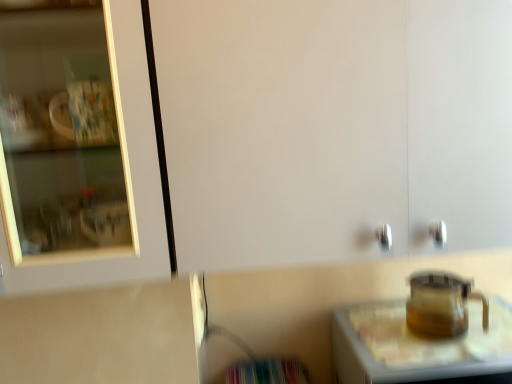
Where is `transparent glass teapot at lower right`? This screenshot has width=512, height=384. transparent glass teapot at lower right is located at coordinates click(441, 304).

This screenshot has height=384, width=512. What do you see at coordinates (441, 304) in the screenshot?
I see `transparent glass teapot at lower right` at bounding box center [441, 304].

The width and height of the screenshot is (512, 384). Describe the element at coordinates (420, 346) in the screenshot. I see `transparent glass table at lower right` at that location.

Identify the location of transparent glass table at lower right. (420, 346).

Where is `transparent glass teapot at lower right`? This screenshot has height=384, width=512. transparent glass teapot at lower right is located at coordinates (441, 304).

Does transparent glass teapot at lower right appear on the left side of transparent glass table at lower right?

Yes, transparent glass teapot at lower right is to the left of transparent glass table at lower right.

In the image, is transparent glass teapot at lower right positioned in front of or behind transparent glass table at lower right?

In the image, transparent glass teapot at lower right appears behind transparent glass table at lower right.

Between point (487, 330) and point (506, 341), which one is positioned behind?

The point (487, 330) is behind.

From the image's perspective, is transparent glass teapot at lower right beneath transparent glass table at lower right?

Actually, transparent glass teapot at lower right appears above transparent glass table at lower right in the image.

From a real-world perspective, is transparent glass teapot at lower right on transparent glass table at lower right?

Yes, from a real-world perspective, transparent glass teapot at lower right is on top of transparent glass table at lower right.

Considering the relative sizes of transparent glass teapot at lower right and transparent glass table at lower right in the image provided, is transparent glass teapot at lower right wider than transparent glass table at lower right?

In fact, transparent glass teapot at lower right might be narrower than transparent glass table at lower right.

Is transparent glass teapot at lower right taller than transparent glass table at lower right?

No.

Can you confirm if transparent glass teapot at lower right is bigger than transparent glass table at lower right?

No, transparent glass teapot at lower right is not bigger than transparent glass table at lower right.

Consider the image. Is transparent glass teapot at lower right positioned beyond the bounds of transparent glass table at lower right?

transparent glass teapot at lower right is positioned outside transparent glass table at lower right.

Consider the image. Does transparent glass teapot at lower right touch transparent glass table at lower right?

Yes, transparent glass teapot at lower right is with transparent glass table at lower right.

Is transparent glass teapot at lower right aimed at transparent glass table at lower right?

No, transparent glass teapot at lower right does not turn towards transparent glass table at lower right.

How different are the orientations of transparent glass teapot at lower right and transparent glass table at lower right in degrees?

There is a 0.00026-degree angle between the facing directions of transparent glass teapot at lower right and transparent glass table at lower right.

How far apart are transparent glass teapot at lower right and transparent glass table at lower right?

The distance of transparent glass teapot at lower right from transparent glass table at lower right is 8.77 centimeters.

Find the location of a particular element. The width and height of the screenshot is (512, 384). table located below the transparent glass teapot at lower right (from the image's perspective) is located at coordinates (420, 346).

Considering the relative positions of transparent glass table at lower right and transparent glass teapot at lower right in the image provided, is transparent glass table at lower right to the left of transparent glass teapot at lower right from the viewer's perspective?

In fact, transparent glass table at lower right is to the right of transparent glass teapot at lower right.

Does transparent glass table at lower right come in front of transparent glass teapot at lower right?

Yes, transparent glass table at lower right is closer to the viewer.

Which is in front, point (472, 381) or point (412, 311)?

The point (472, 381) is closer to the camera.

From the image's perspective, between transparent glass table at lower right and transparent glass teapot at lower right, which one is located above?

transparent glass teapot at lower right appears higher in the image.

From a real-world perspective, is transparent glass table at lower right positioned under transparent glass teapot at lower right based on gravity?

Indeed, from a real-world perspective, transparent glass table at lower right is positioned beneath transparent glass teapot at lower right.

Is transparent glass table at lower right wider or thinner than transparent glass teapot at lower right?

transparent glass table at lower right is wider than transparent glass teapot at lower right.

Between transparent glass table at lower right and transparent glass teapot at lower right, which one has less height?

transparent glass teapot at lower right is shorter.

Based on their sizes in the image, would you say transparent glass table at lower right is bigger or smaller than transparent glass teapot at lower right?

Clearly, transparent glass table at lower right is larger in size than transparent glass teapot at lower right.

Is transparent glass table at lower right surrounding transparent glass teapot at lower right?

No, transparent glass teapot at lower right is not a part of transparent glass table at lower right.

Is transparent glass table at lower right directly adjacent to transparent glass teapot at lower right?

Yes, transparent glass table at lower right is touching transparent glass teapot at lower right.

Is transparent glass table at lower right positioned with its back to transparent glass teapot at lower right?

transparent glass table at lower right is not turned away from transparent glass teapot at lower right.

The width and height of the screenshot is (512, 384). What are the coordinates of `table on the right of transparent glass teapot at lower right` in the screenshot? It's located at (420, 346).

Identify the location of appliance that is above the transparent glass table at lower right (from the image's perspective). (441, 304).

There is a transparent glass table at lower right. At what (x,y) coordinates should I click in order to perform the action: click on appliance above it (from a real-world perspective). Please return your answer as a coordinate pair (x, y). This screenshot has height=384, width=512. Looking at the image, I should click on (441, 304).